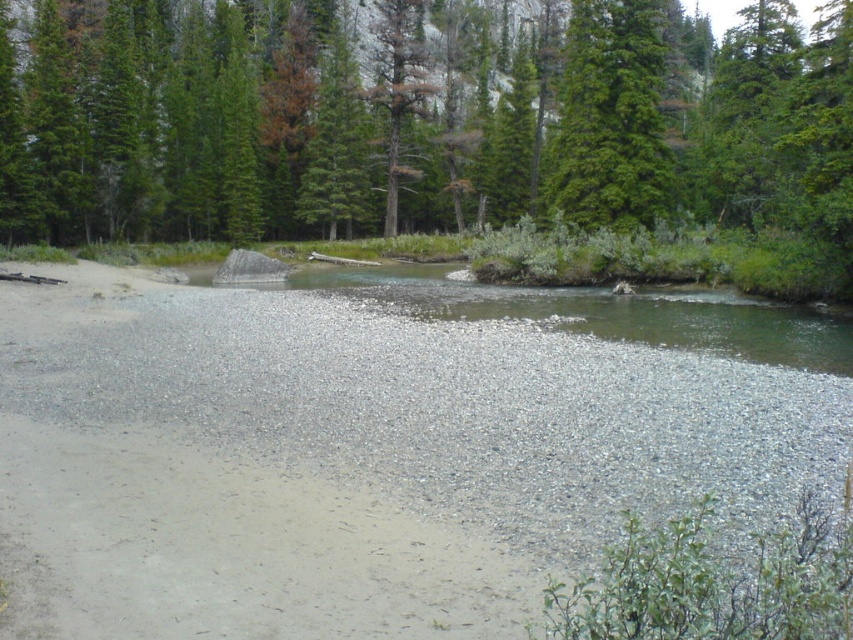
Is green leafy forest at upper center to the left of green textured tree at upper right from the viewer's perspective?

Indeed, green leafy forest at upper center is positioned on the left side of green textured tree at upper right.

Based on the photo, who is lower down, green leafy forest at upper center or green textured tree at upper right?

green textured tree at upper right is below.

Describe the element at coordinates (432, 124) in the screenshot. The image size is (853, 640). I see `green leafy forest at upper center` at that location.

At what (x,y) coordinates should I click in order to perform the action: click on green leafy forest at upper center. Please return your answer as a coordinate pair (x, y). Looking at the image, I should click on (432, 124).

The width and height of the screenshot is (853, 640). Find the location of `gray gravel at center`. gray gravel at center is located at coordinates (351, 458).

Between gray gravel at center and clear water at center, which one has more height?

clear water at center

Is point (91, 268) closer to viewer compared to point (541, 305)?

No, it is not.

The image size is (853, 640). I want to click on gray gravel at center, so click(x=351, y=458).

In the scene shown: Which of these two, green leafy forest at upper center or clear water at center, stands taller?

green leafy forest at upper center is taller.

Is point (91, 220) in front of point (677, 308)?

No, (91, 220) is further to viewer.

Identify the location of green leafy forest at upper center. This screenshot has height=640, width=853. (432, 124).

This screenshot has height=640, width=853. I want to click on green leafy forest at upper center, so click(x=432, y=124).